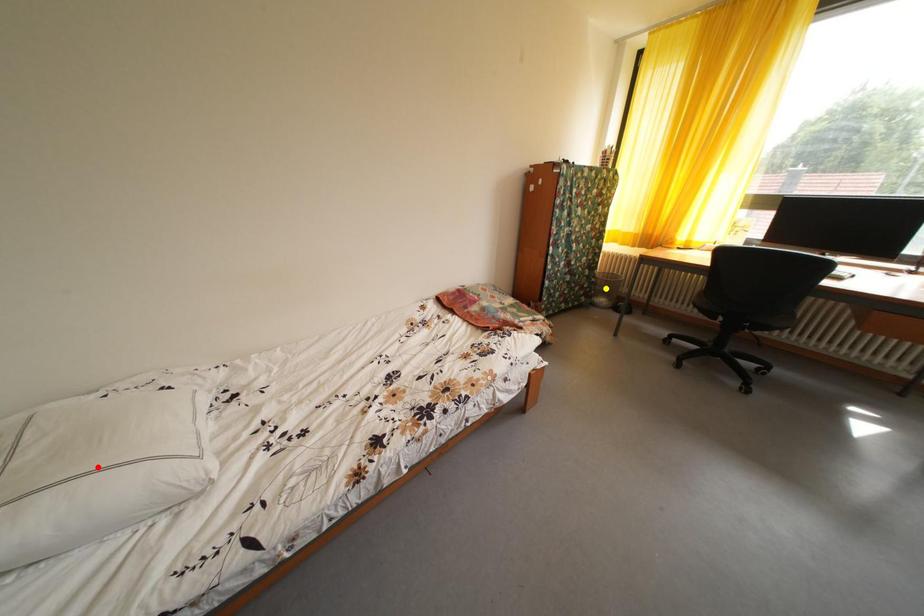
Order these from nearest to farthest:
red point
purple point
yellow point

purple point → red point → yellow point